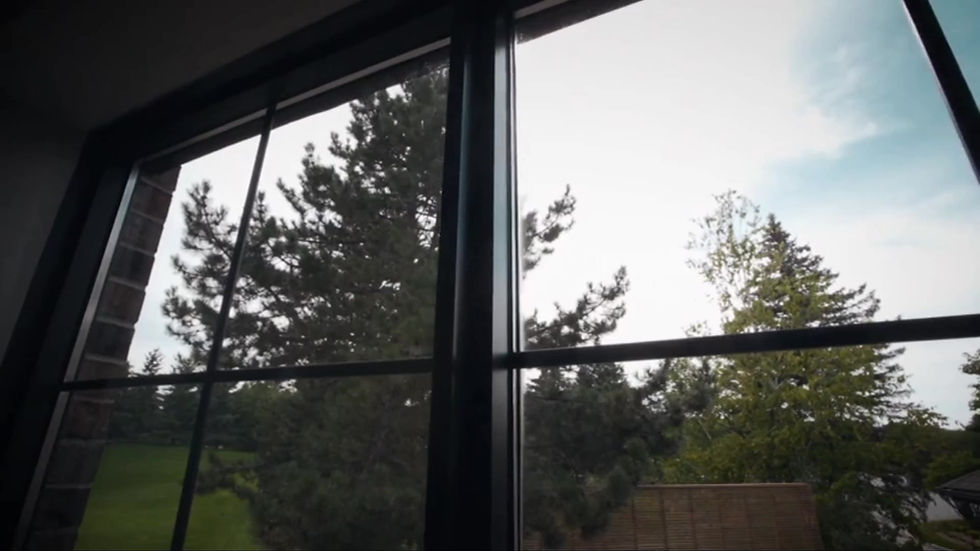
Identify the location of interior wall. (39, 139).